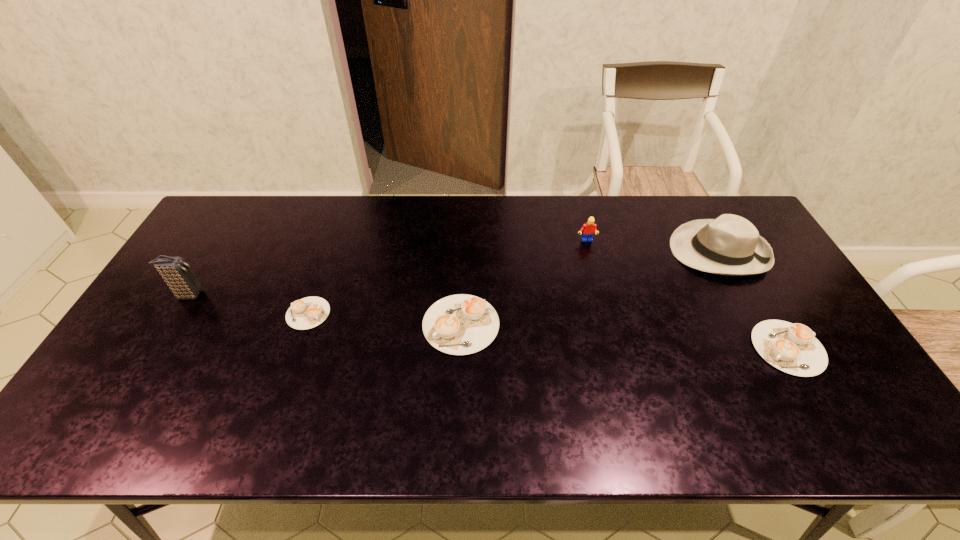
You are a GUI agent. You are given a task and a screenshot of the screen. Output one action in this format:
    pyautogui.click(x=<x>, y=<y>)
    Task: Click on the shortest cappuccino
    The width and height of the screenshot is (960, 540).
    Given the screenshot: What is the action you would take?
    pyautogui.click(x=309, y=312)

Where is `the shortest object`? the shortest object is located at coordinates (309, 312).

You are a GUI agent. You are given a task and a screenshot of the screen. Output one action in this format:
    pyautogui.click(x=<x>, y=<y>)
    Task: Click on the third object from left to right
    Image resolution: width=960 pixels, height=540 pixels.
    Given the screenshot: What is the action you would take?
    pyautogui.click(x=461, y=324)

Identify the location of the rightmost cappuccino. The image size is (960, 540). (792, 348).

This screenshot has width=960, height=540. In order to click on the second tallest cappuccino in this screenshot , I will do tap(792, 348).

Where is `the second tallest object`? The height and width of the screenshot is (540, 960). the second tallest object is located at coordinates (730, 245).

The image size is (960, 540). Identify the location of the third object from right to left. (x=589, y=229).

Find the location of a particular element. Image resolution: width=960 pixels, height=540 pixels. the third tallest object is located at coordinates (589, 229).

Where is `the tallest object`? The width and height of the screenshot is (960, 540). the tallest object is located at coordinates (178, 275).

You are a GUI agent. You are given a task and a screenshot of the screen. Output one action in this format:
    pyautogui.click(x=<x>, y=<y>)
    Task: Click on the leftmost object
    This screenshot has width=960, height=540.
    Given the screenshot: What is the action you would take?
    pyautogui.click(x=178, y=275)